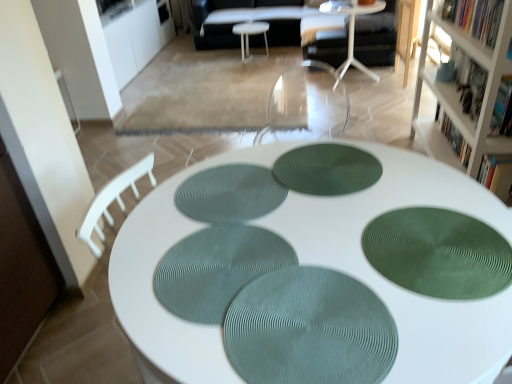
This screenshot has height=384, width=512. Identify the location of vacant space that's between green textured placemat at center, the 2th mat viewed from the right, and green textured placemat at center. pyautogui.click(x=323, y=232).